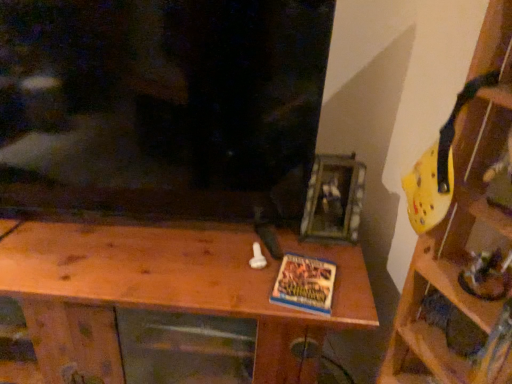
This screenshot has height=384, width=512. I want to click on vacant area on the back side of blue matte book at center, so click(x=308, y=250).